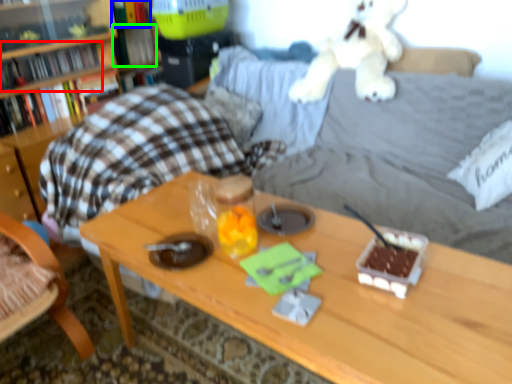
Question: Considering the real-world distances, which object is farthest from book (highlighted by a red box)? book (highlighted by a blue box) or book (highlighted by a green box)?

Choices:
 (A) book
 (B) book

Answer: (A)